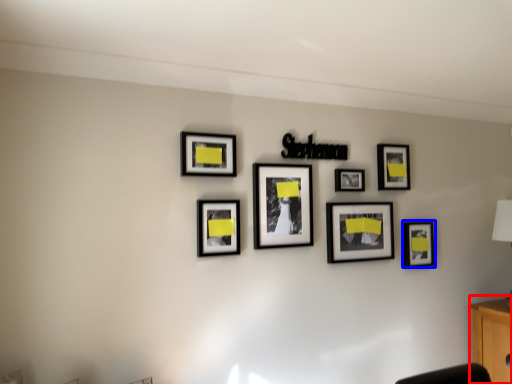
Question: Which object is further to the camera taking this photo, computer desk (highlighted by a red box) or picture frame (highlighted by a blue box)?

Choices:
 (A) computer desk
 (B) picture frame

Answer: (B)